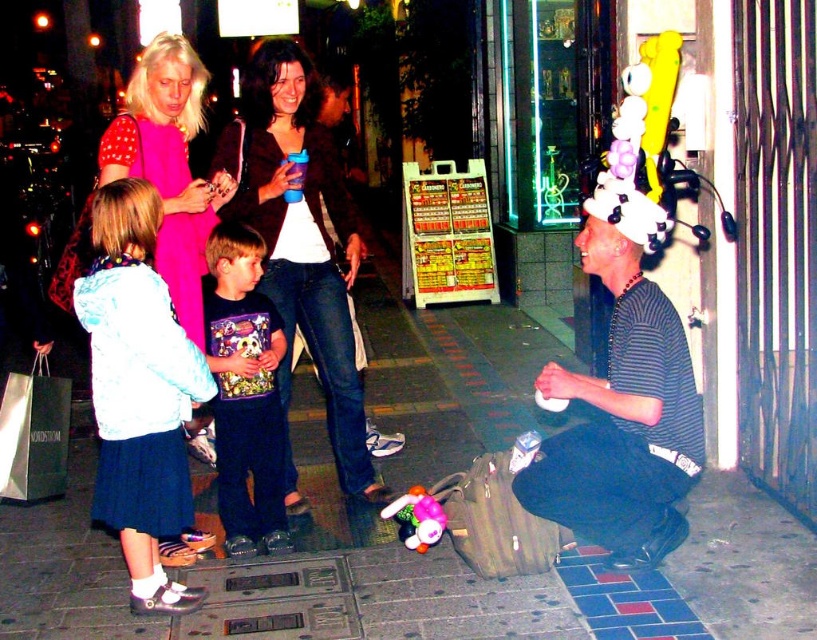
Question: Is striped cotton shirt at lower right positioned at the back of matte black jacket at center?

Choices:
 (A) no
 (B) yes

Answer: (A)

Question: Among these points, which one is farthest from the camera?

Choices:
 (A) (315, 237)
 (B) (407, 524)

Answer: (A)

Question: Among these points, which one is farthest from the camera?

Choices:
 (A) (211, 300)
 (B) (427, 518)
 (C) (346, 364)
 (D) (621, 227)

Answer: (C)

Question: Considering the relative positions of blue fabric skirt at lower left and matte black jacket at center in the image provided, where is blue fabric skirt at lower left located with respect to matte black jacket at center?

Choices:
 (A) right
 (B) left

Answer: (B)

Question: Can you confirm if striped cotton shirt at lower right is positioned above plush multicolored toy at lower center?

Choices:
 (A) yes
 (B) no

Answer: (A)

Question: Which of the following is the closest to the observer?

Choices:
 (A) dark blue jeans at center
 (B) blue fabric skirt at lower left
 (C) striped cotton shirt at lower right
 (D) matte black jacket at center

Answer: (B)